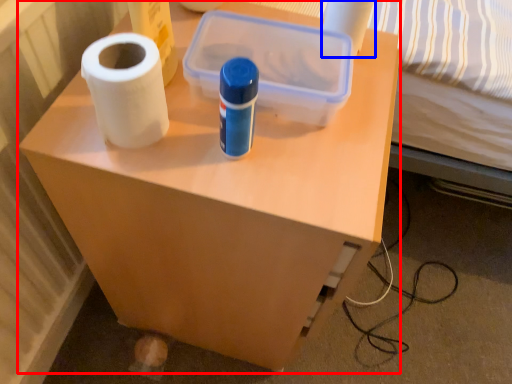
Question: Which point is further to the camera, furniture (highlighted by a red box) or toilet paper (highlighted by a blue box)?

Choices:
 (A) furniture
 (B) toilet paper

Answer: (B)